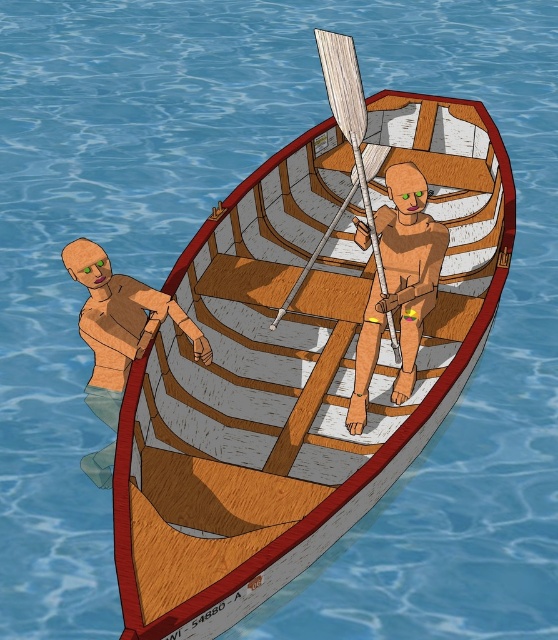
Question: Among these objects, which one is farthest from the camera?

Choices:
 (A) wooden paddle at center
 (B) wooden boat at center
 (C) wooden man at left
 (D) wooden oar at center

Answer: (D)

Question: Does wooden boat at center appear on the left side of wooden paddle at center?

Choices:
 (A) yes
 (B) no

Answer: (A)

Question: Considering the real-world distances, which object is farthest from the wooden paddle at center?

Choices:
 (A) wooden boat at center
 (B) wooden man at left
 (C) wooden oar at center

Answer: (B)

Question: Is wooden boat at center below wooden man at left?

Choices:
 (A) no
 (B) yes

Answer: (A)

Question: Is wooden man at left above wooden paddle at center?

Choices:
 (A) yes
 (B) no

Answer: (B)

Question: Which object is farther from the camera taking this photo?

Choices:
 (A) wooden paddle at center
 (B) wooden oar at center
 (C) wooden boat at center
 (D) wooden man at left

Answer: (B)